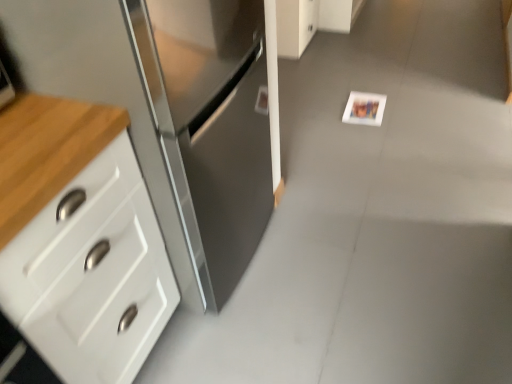
Question: From a real-world perspective, is white glossy cabinet at upper center, placed as the 1th cabinetry when sorted from right to left, above or below white matte postcard at center?

Choices:
 (A) above
 (B) below

Answer: (A)

Question: Considering the relative positions of white glossy cabinet at upper center, which appears as the second cabinetry when viewed from the left, and white matte postcard at center in the image provided, is white glossy cabinet at upper center, which appears as the second cabinetry when viewed from the left, to the left or to the right of white matte postcard at center?

Choices:
 (A) right
 (B) left

Answer: (B)

Question: Estimate the real-world distances between objects in this image. Which object is closer to the stainless steel cabinet at left, the first cabinetry positioned from the left?

Choices:
 (A) white matte postcard at center
 (B) white glossy cabinet at upper center, placed as the 1th cabinetry when sorted from right to left

Answer: (A)

Question: Which is farther from the stainless steel cabinet at left, positioned as the second cabinetry in right-to-left order?

Choices:
 (A) white glossy cabinet at upper center, the second cabinetry when ordered from bottom to top
 (B) white matte postcard at center

Answer: (A)